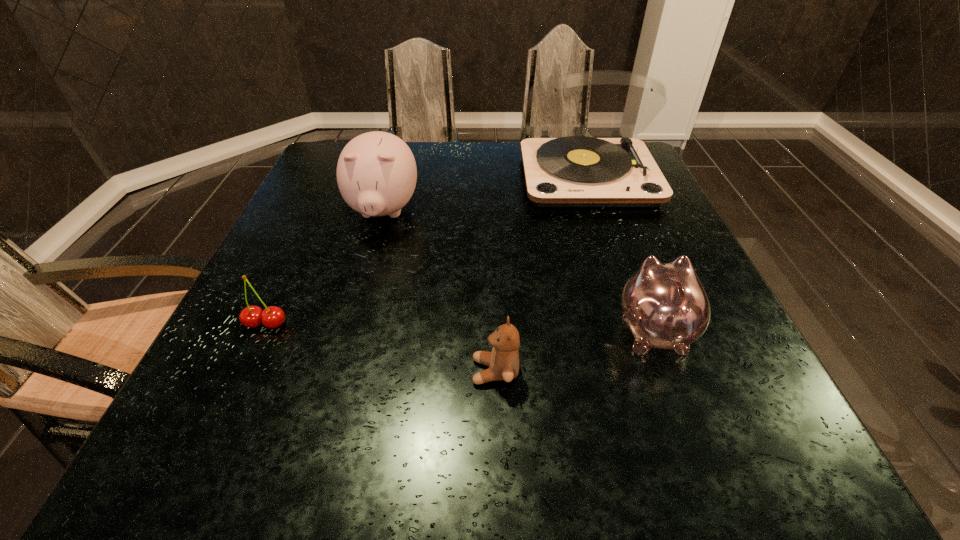
Identify the location of vacant area between the right piggy bank and the teddy bear. This screenshot has height=540, width=960. (574, 350).

The width and height of the screenshot is (960, 540). I want to click on empty space that is in between the second object from left to right and the cherry, so coord(324,268).

Where is `empty space that is in between the leftmost object and the record player`? empty space that is in between the leftmost object and the record player is located at coordinates (426, 249).

The width and height of the screenshot is (960, 540). I want to click on vacant area that lies between the tallest object and the teddy bear, so click(x=541, y=273).

Locate an element on the screen. Image resolution: width=960 pixels, height=540 pixels. vacant region between the second object from left to right and the tallest object is located at coordinates (486, 194).

Locate an element on the screen. vacant point located between the shorter piggy bank and the teddy bear is located at coordinates (574, 350).

The image size is (960, 540). I want to click on object that can be found as the third closest to the teddy bear, so point(272,317).

Identify which object is the fourth closest to the teddy bear. Please provide its 2D coordinates. Your answer should be formatted as a tuple, i.e. [(x, y)], where the tuple contains the x and y coordinates of a point satisfying the conditions above.

[(576, 171)]

Image resolution: width=960 pixels, height=540 pixels. What are the coordinates of `vacant area that satisfies the following two spatial constraints: 1. with the tonearm facing the front of the tallest object; 2. on the front-facing side of the third object from left to right` in the screenshot? It's located at (655, 372).